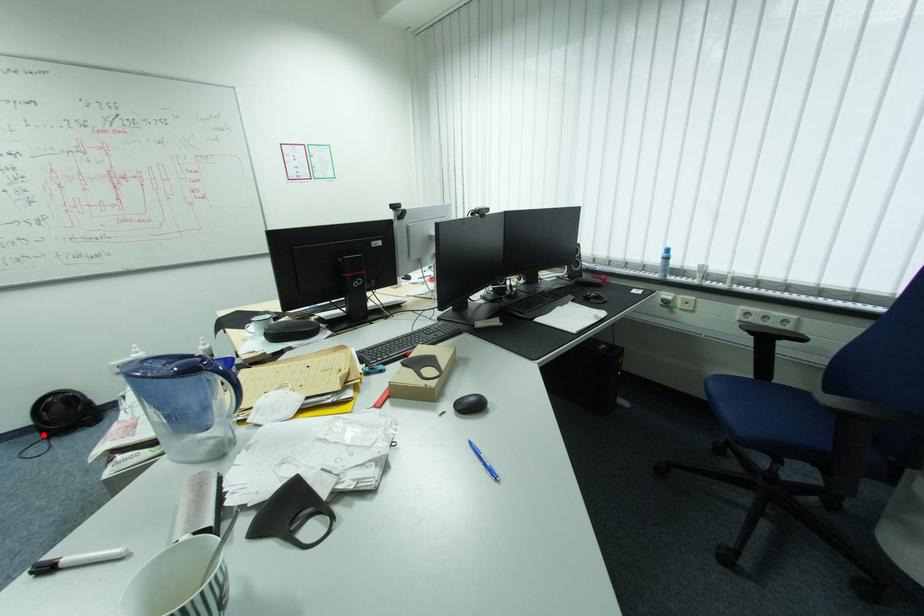
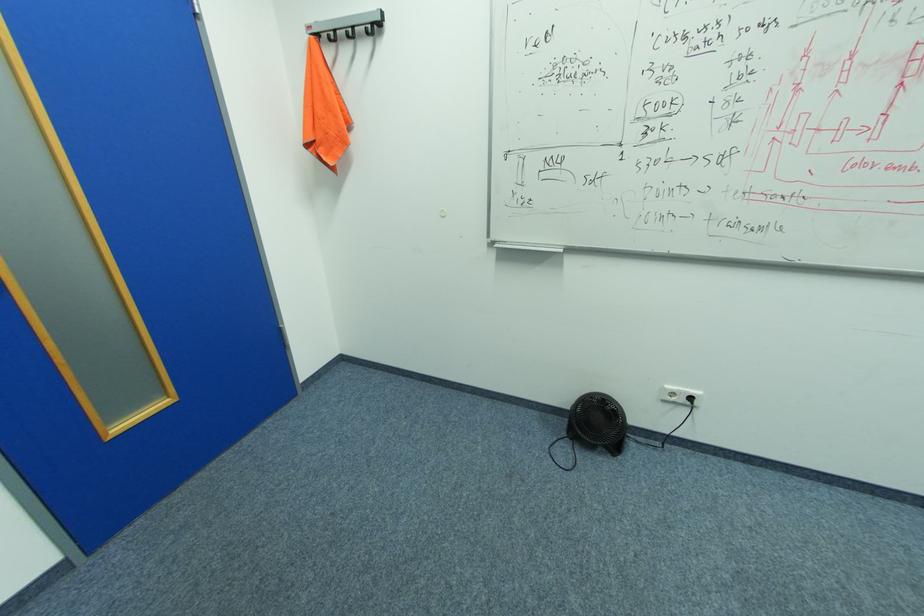
Question: I am providing you with two images of the same scene from different viewpoints. Given a red point in image1, look at the same physical point in image2. Is it:

Choices:
 (A) Closer to the viewpoint
 (B) Farther from the viewpoint

Answer: (B)